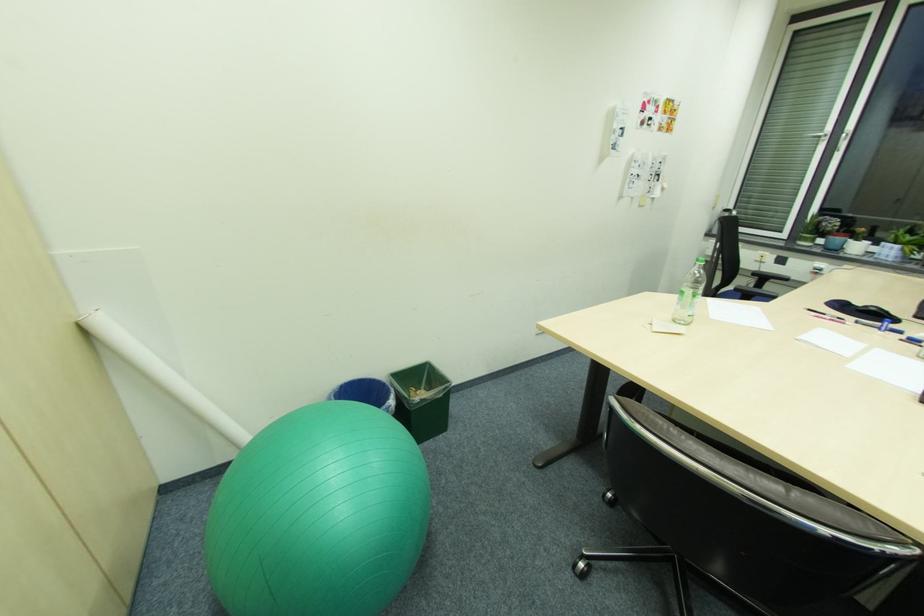
The location [366,392] corresponds to which object?

This point indicates the blue trash can.